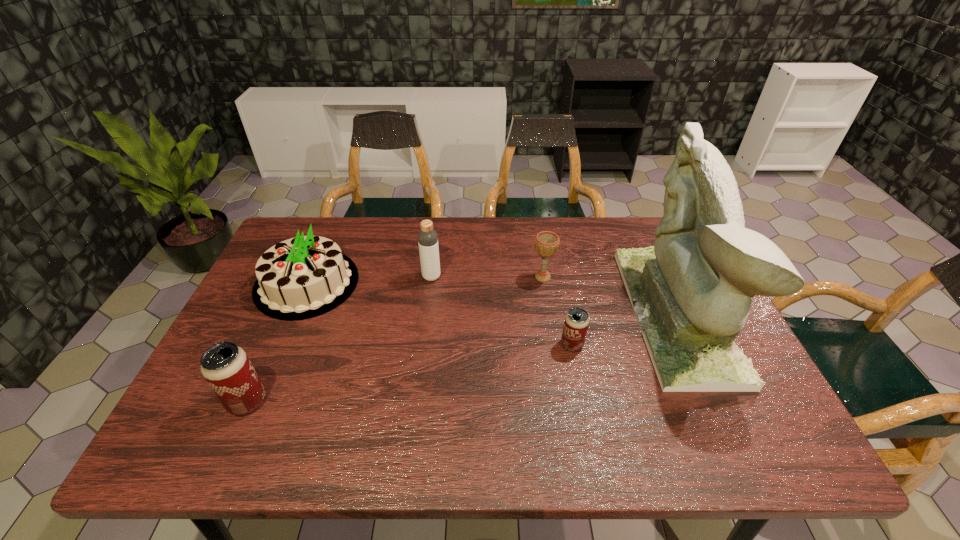
Where is `sculpture that is at the near edge`? sculpture that is at the near edge is located at coordinates (691, 292).

At what (x,y) coordinates should I click in order to perform the action: click on beer can that is positioned at the left edge. Please return your answer as a coordinate pair (x, y). This screenshot has width=960, height=540. Looking at the image, I should click on coord(226,367).

Locate an element on the screen. This screenshot has width=960, height=540. birthday cake positioned at the left edge is located at coordinates (300, 278).

Locate an element on the screen. object at the right edge is located at coordinates (691, 292).

The width and height of the screenshot is (960, 540). Identify the location of object that is at the far left corner. (300, 278).

The width and height of the screenshot is (960, 540). I want to click on object located in the near left corner section of the desktop, so click(x=226, y=367).

The height and width of the screenshot is (540, 960). I want to click on object that is at the far right corner, so click(x=691, y=292).

This screenshot has width=960, height=540. I want to click on object that is positioned at the near right corner, so click(x=691, y=292).

In the image, there is a desktop. Identify the location of vacant space at the far edge. Image resolution: width=960 pixels, height=540 pixels. (387, 218).

You are a GUI agent. You are given a task and a screenshot of the screen. Output one action in this format:
    pyautogui.click(x=<x>, y=<y>)
    Task: Click on the blank space at the near edge of the desktop
    
    Given the screenshot: What is the action you would take?
    pyautogui.click(x=279, y=393)